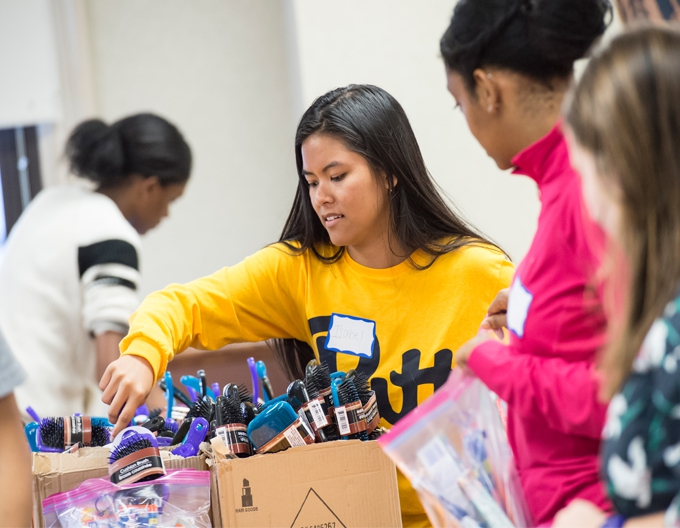
Where is `box`? Image resolution: width=680 pixels, height=528 pixels. box is located at coordinates (65, 477), (298, 456).